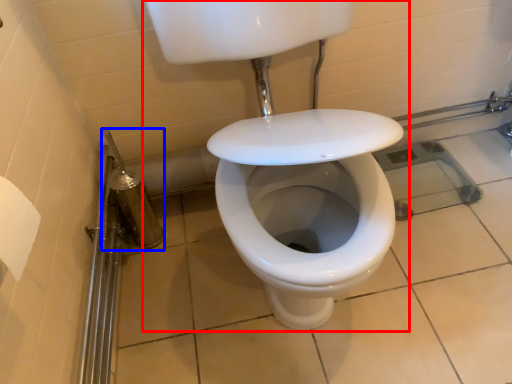
Question: Which of the following is the closest to the observer, sink (highlighted by a red box) or shower (highlighted by a blue box)?

Choices:
 (A) sink
 (B) shower

Answer: (A)